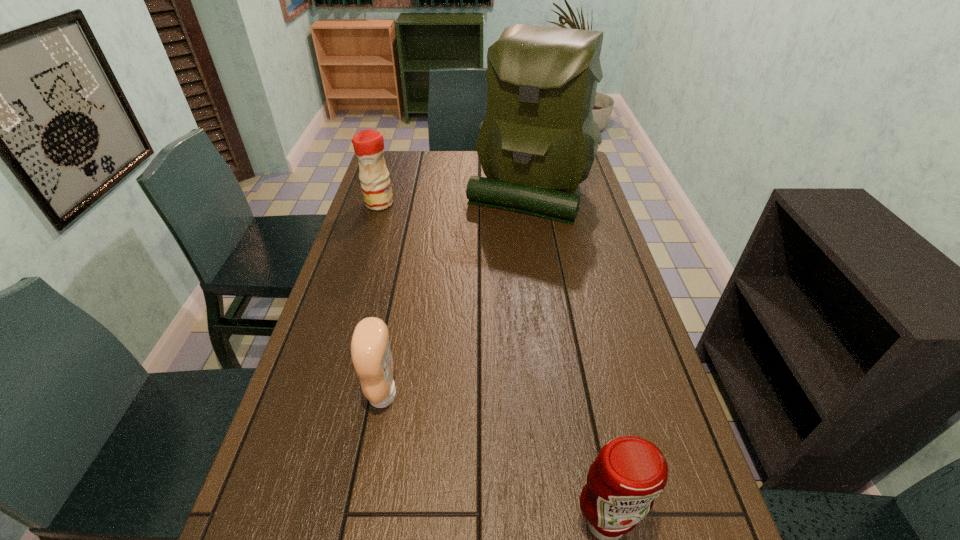
Image resolution: width=960 pixels, height=540 pixels. What are the coordinates of `object positioned at the right edge` in the screenshot? It's located at (537, 143).

At what (x,y) coordinates should I click in order to perform the action: click on object that is at the far right corner. Please return your answer as a coordinate pair (x, y). The height and width of the screenshot is (540, 960). Looking at the image, I should click on (537, 143).

This screenshot has height=540, width=960. In order to click on free space at the far edge of the desktop in this screenshot , I will do `click(444, 176)`.

Image resolution: width=960 pixels, height=540 pixels. Find the location of `vacant point at the left edge`. vacant point at the left edge is located at coordinates (348, 348).

I want to click on free spot at the right edge of the desktop, so click(x=645, y=379).

You are a GUI agent. You are given a task and a screenshot of the screen. Output one action in this format:
    pyautogui.click(x=<x>, y=<y>)
    Task: Click on the vacant space at the far left corner of the desktop
    The width and height of the screenshot is (960, 540).
    Given the screenshot: What is the action you would take?
    pyautogui.click(x=391, y=167)

Locate an element on the screen. Image resolution: width=960 pixels, height=540 pixels. blank region between the farthest condiment and the tallest object is located at coordinates (454, 197).

At what (x,y) coordinates should I click in order to perform the action: click on free spot between the farthest condiment and the tallest object. Please return your answer as a coordinate pair (x, y). Image resolution: width=960 pixels, height=540 pixels. Looking at the image, I should click on (454, 197).

Locate an element on the screen. The height and width of the screenshot is (540, 960). blank region between the backpack and the second condiment from right to left is located at coordinates (456, 293).

In order to click on vacant space that is in between the leftmost condiment and the backpack in this screenshot , I will do `click(454, 197)`.